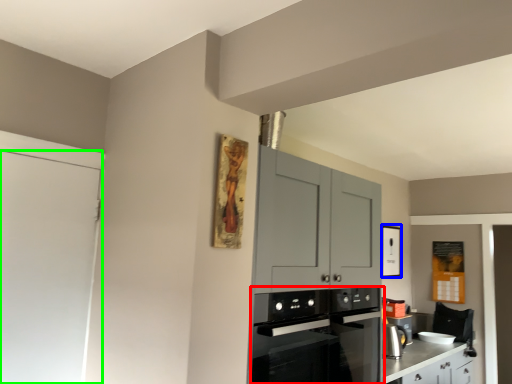
Question: Considering the real-world distances, which object is farthest from kitchen appliance (highlighted by a red box)? picture frame (highlighted by a blue box) or door (highlighted by a green box)?

Choices:
 (A) picture frame
 (B) door

Answer: (A)